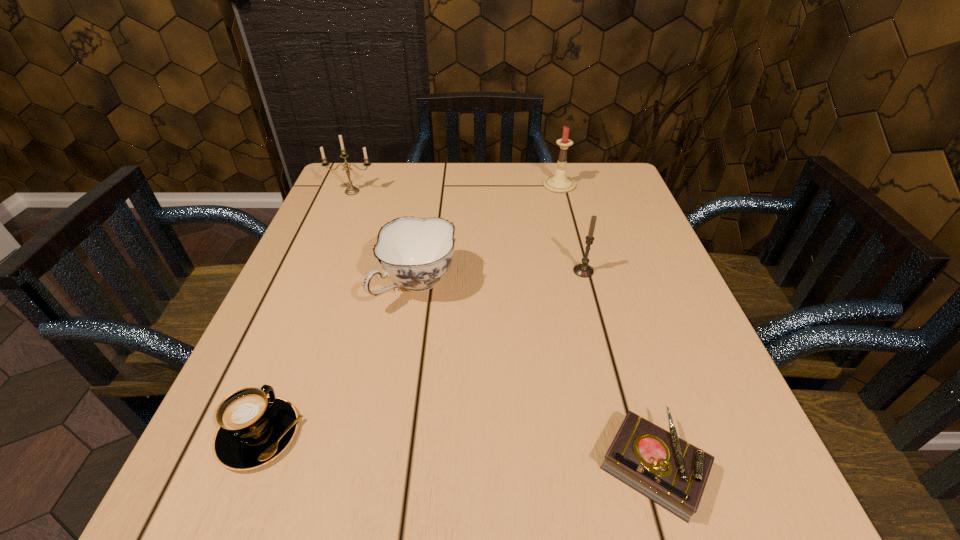
I want to click on free region at the far edge, so click(x=542, y=166).

The width and height of the screenshot is (960, 540). In the image, there is a desktop. Identify the location of blank space at the near edge. (530, 492).

This screenshot has width=960, height=540. What are the coordinates of `vacant space at the left edge` in the screenshot? It's located at (375, 214).

Image resolution: width=960 pixels, height=540 pixels. In order to click on vacant space at the right edge in this screenshot , I will do `click(614, 304)`.

In the image, there is a desktop. At what (x,y) coordinates should I click in order to perform the action: click on vacant space at the far left corner. Please return your answer as a coordinate pair (x, y). This screenshot has height=540, width=960. Looking at the image, I should click on (321, 206).

The image size is (960, 540). I want to click on free space at the far right corner of the desktop, so click(x=603, y=174).

Image resolution: width=960 pixels, height=540 pixels. In order to click on vacant area that lies between the cappuccino and the nearest candle in this screenshot , I will do `click(421, 353)`.

Where is `free space between the leftmost candle and the nearest candle`? The height and width of the screenshot is (540, 960). free space between the leftmost candle and the nearest candle is located at coordinates (468, 231).

What are the coordinates of `free space between the shortest object and the nearest candle` in the screenshot? It's located at (618, 368).

The width and height of the screenshot is (960, 540). I want to click on vacant space that's between the nearest candle and the leftmost candle, so click(468, 231).